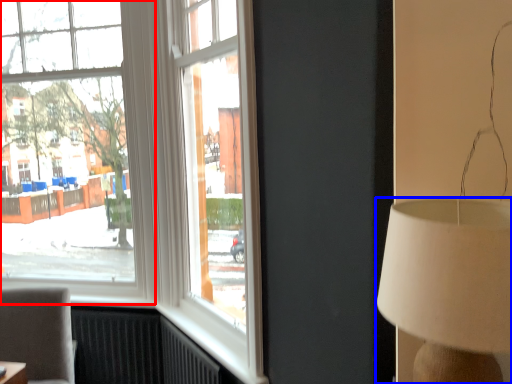
Question: Which point is closer to the camera, window (highlighted by a red box) or lamp (highlighted by a blue box)?

Choices:
 (A) window
 (B) lamp

Answer: (B)